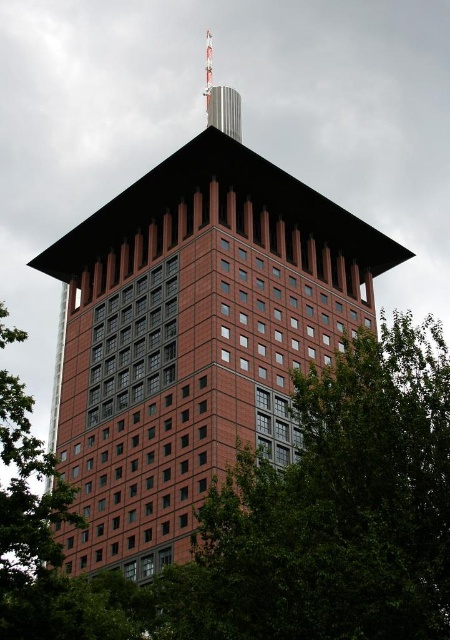
Which is below, green leafy tree at center or green leafy tree at lower left?

Positioned lower is green leafy tree at lower left.

Is green leafy tree at center positioned at the back of green leafy tree at lower left?

That is False.

Identify the location of green leafy tree at center. The height and width of the screenshot is (640, 450). (333, 509).

The height and width of the screenshot is (640, 450). What are the coordinates of `green leafy tree at center` in the screenshot? It's located at (333, 509).